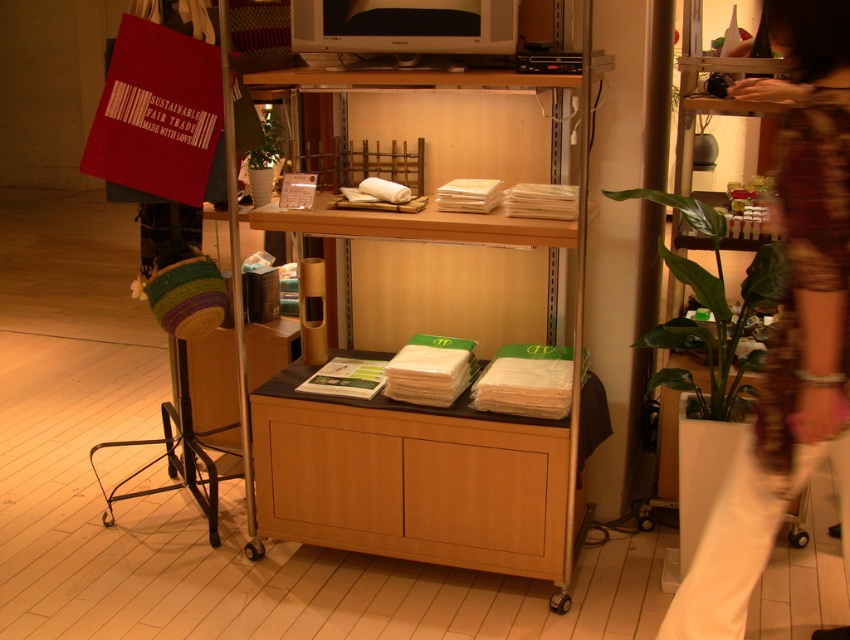
You are a customer in a store and want to place a small item on the wooden cabinet at center. However, there is a green leafy plant at right nearby. Which object should you avoid placing the item on to ensure it stays stable?

You should avoid placing the item on the green leafy plant at right because the wooden cabinet at center is a stable surface, while the plant might be less sturdy and could tip over.